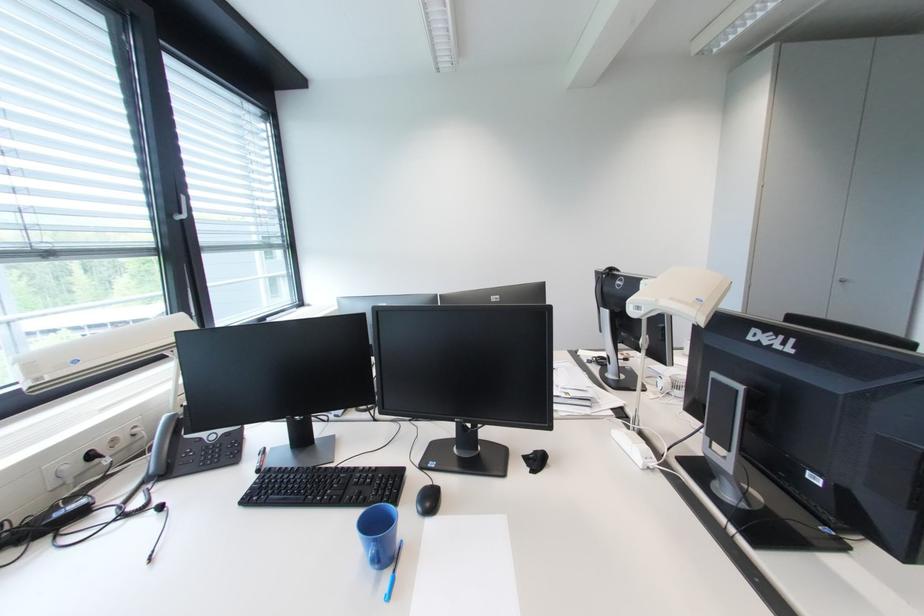
You are a GUI agent. You are given a task and a screenshot of the screen. Output one action in this format:
    pyautogui.click(x=<x>, y=<y>)
    Task: Click on the blue cup handle
    This screenshot has height=616, width=924.
    Given the screenshot: What is the action you would take?
    pyautogui.click(x=375, y=554)